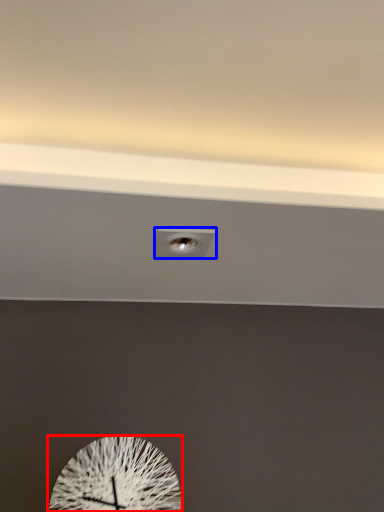
Question: Among these objects, which one is farthest to the camera, wall clock (highlighted by a red box) or electric outlet (highlighted by a blue box)?

Choices:
 (A) wall clock
 (B) electric outlet

Answer: (A)